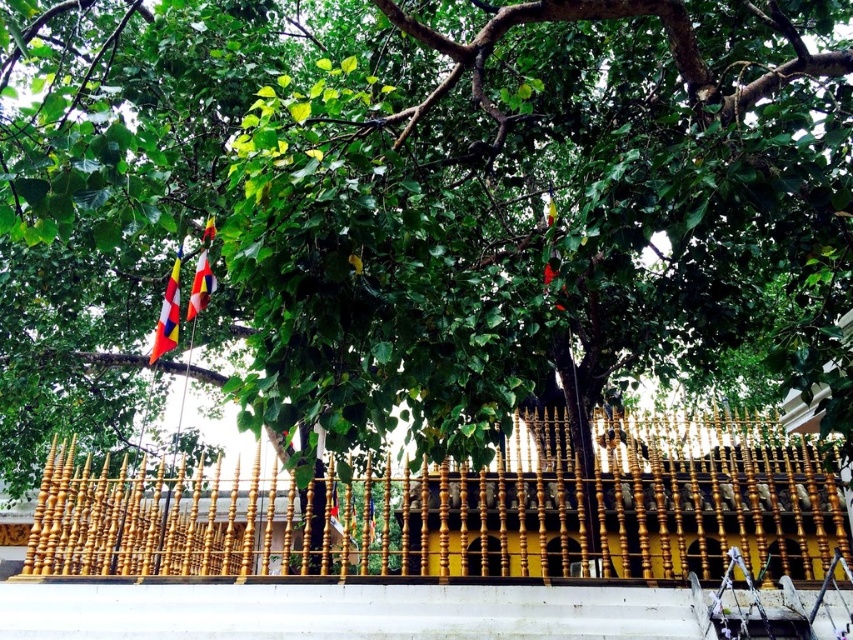
From the picture: Is gold polished wood fence at center positioned at the back of multicolored fabric flag at left?

Yes, gold polished wood fence at center is further from the viewer.

Does gold polished wood fence at center have a smaller size compared to multicolored fabric flag at left?

Correct, gold polished wood fence at center occupies less space than multicolored fabric flag at left.

Image resolution: width=853 pixels, height=640 pixels. What are the coordinates of `gold polished wood fence at center` in the screenshot? It's located at (461, 513).

Image resolution: width=853 pixels, height=640 pixels. What are the coordinates of `gold polished wood fence at center` in the screenshot? It's located at (461, 513).

Is gold polished wood fence at center closer to the viewer compared to multi-colored fabric flag at upper left?

That is False.

Who is positioned more to the right, gold polished wood fence at center or multi-colored fabric flag at upper left?

From the viewer's perspective, gold polished wood fence at center appears more on the right side.

Between point (715, 461) and point (195, 305), which one is positioned behind?

Point (715, 461)

Where is `gold polished wood fence at center`? This screenshot has height=640, width=853. gold polished wood fence at center is located at coordinates (461, 513).

Does multicolored fabric flag at left have a larger size compared to multi-colored fabric flag at upper left?

Actually, multicolored fabric flag at left might be smaller than multi-colored fabric flag at upper left.

Does point (171, 314) lie in front of point (201, 240)?

No.

Measure the distance between point (165, 294) and camera.

6.30 meters

Locate an element on the screen. This screenshot has width=853, height=640. multicolored fabric flag at left is located at coordinates (167, 314).